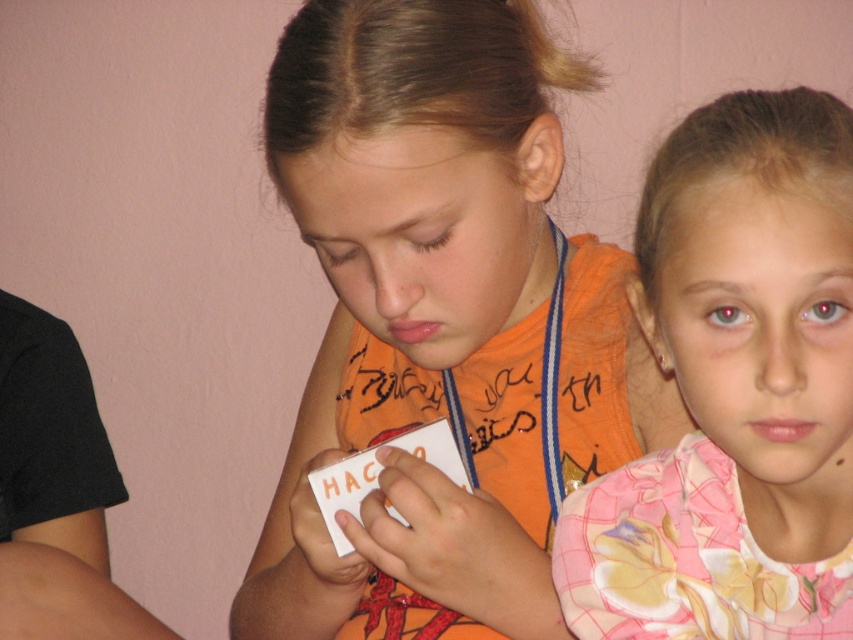
Is orange fabric shirt at center smaller than pink floral shirt at upper right?

Incorrect, orange fabric shirt at center is not smaller in size than pink floral shirt at upper right.

What do you see at coordinates (440, 321) in the screenshot? I see `orange fabric shirt at center` at bounding box center [440, 321].

Between point (523, 179) and point (802, 237), which one is positioned in front?

Positioned in front is point (802, 237).

This screenshot has width=853, height=640. I want to click on orange fabric shirt at center, so click(x=440, y=321).

Is pink floral shirt at upper right wider than white paper card at center?

Indeed, pink floral shirt at upper right has a greater width compared to white paper card at center.

Is pink floral shirt at upper right smaller than white paper card at center?

No.

Measure the distance between pink floral shirt at upper right and camera.

pink floral shirt at upper right and camera are 20.97 inches apart.

At what (x,y) coordinates should I click in order to perform the action: click on pink floral shirt at upper right. Please return your answer as a coordinate pair (x, y). Looking at the image, I should click on (734, 390).

Does orange fabric shirt at center have a lesser width compared to white paper card at center?

In fact, orange fabric shirt at center might be wider than white paper card at center.

Can you confirm if orange fabric shirt at center is positioned to the left of white paper card at center?

In fact, orange fabric shirt at center is to the right of white paper card at center.

Does point (543, 572) come behind point (416, 428)?

No, (543, 572) is in front of (416, 428).

Locate an element on the screen. This screenshot has width=853, height=640. orange fabric shirt at center is located at coordinates (440, 321).